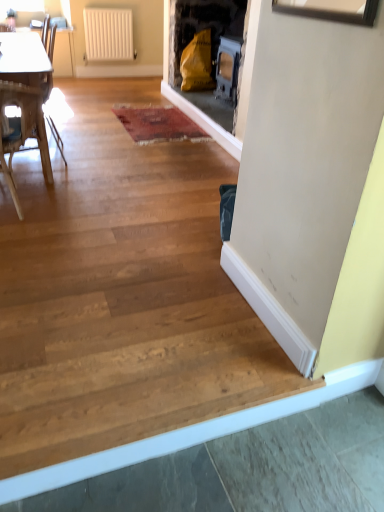
Question: Can white plastic radiator at upper center be found inside wooden chair at left?

Choices:
 (A) no
 (B) yes

Answer: (A)

Question: From a real-world perspective, is wooden chair at left over white plastic radiator at upper center?

Choices:
 (A) no
 (B) yes

Answer: (A)

Question: Is wooden chair at left not within white plastic radiator at upper center?

Choices:
 (A) yes
 (B) no

Answer: (A)

Question: From the image's perspective, is wooden chair at left below white plastic radiator at upper center?

Choices:
 (A) yes
 (B) no

Answer: (A)

Question: Is the position of wooden chair at left more distant than that of white plastic radiator at upper center?

Choices:
 (A) no
 (B) yes

Answer: (A)

Question: Does wooden chair at left turn towards white plastic radiator at upper center?

Choices:
 (A) no
 (B) yes

Answer: (B)

Question: Is wooden armchair at left not close to wooden chair at left?

Choices:
 (A) yes
 (B) no

Answer: (A)

Question: Is wooden armchair at left not inside wooden chair at left?

Choices:
 (A) no
 (B) yes

Answer: (B)

Question: Could you tell me if wooden armchair at left is turned towards wooden chair at left?

Choices:
 (A) no
 (B) yes

Answer: (A)

Question: Can you confirm if wooden armchair at left is wider than wooden chair at left?

Choices:
 (A) yes
 (B) no

Answer: (B)

Question: Is wooden armchair at left looking in the opposite direction of wooden chair at left?

Choices:
 (A) no
 (B) yes

Answer: (A)

Question: From the image's perspective, is wooden armchair at left located above wooden chair at left?

Choices:
 (A) yes
 (B) no

Answer: (A)

Question: Does white plastic radiator at upper center lie in front of wooden armchair at left?

Choices:
 (A) no
 (B) yes

Answer: (A)